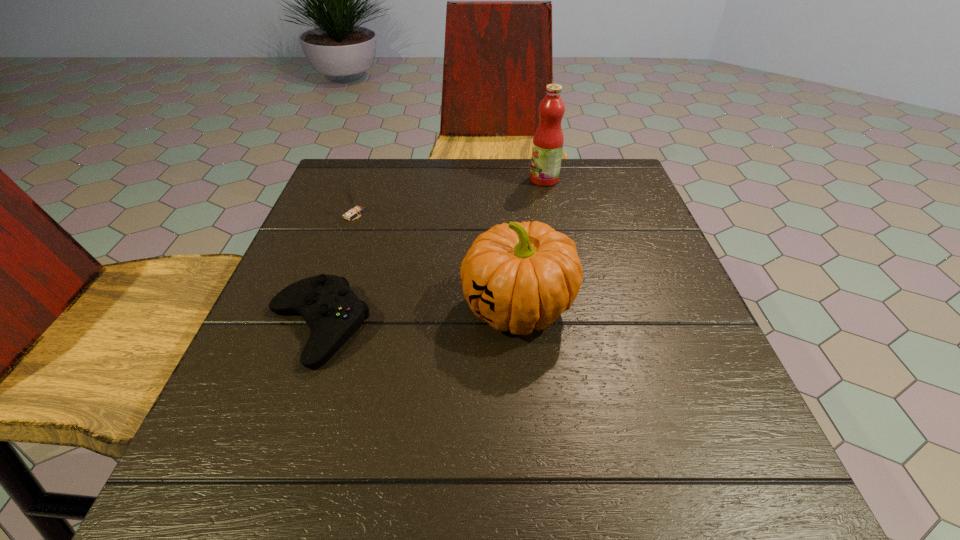
Find the location of `the farthest object`. the farthest object is located at coordinates (547, 147).

Image resolution: width=960 pixels, height=540 pixels. Find the location of `fruit juice`. fruit juice is located at coordinates (547, 147).

Find the location of `pumpkin`. pumpkin is located at coordinates (517, 277).

The height and width of the screenshot is (540, 960). What are the coordinates of `matchbox` in the screenshot? It's located at (355, 209).

This screenshot has height=540, width=960. Find the location of `the third tallest object`. the third tallest object is located at coordinates (355, 209).

Where is `the shortest object`? the shortest object is located at coordinates [333, 312].

Where is `vacant region located 0.210m on the front label of the tallest object`? The width and height of the screenshot is (960, 540). vacant region located 0.210m on the front label of the tallest object is located at coordinates (447, 179).

Find the location of a particular element. This screenshot has height=540, width=960. vacant space located 0.350m on the front label of the tallest object is located at coordinates (394, 179).

Locate an element on the screen. vacant point located on the front label of the tallest object is located at coordinates (506, 179).

Identify the location of free spot located 0.200m on the surface of the pumpkin. The width and height of the screenshot is (960, 540). (351, 308).